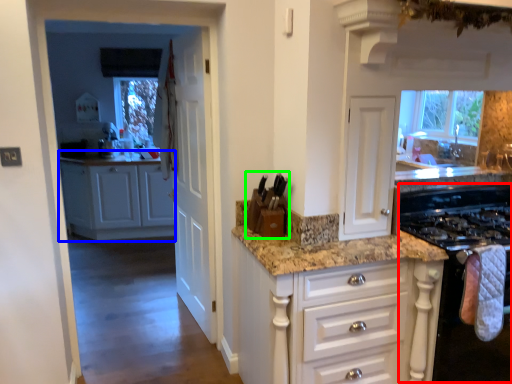
Question: Which object is the closest to the appliance (highlighted by a red box)? Choose among these: cabinetry (highlighted by a blue box) or appliance (highlighted by a green box).

Choices:
 (A) cabinetry
 (B) appliance

Answer: (B)